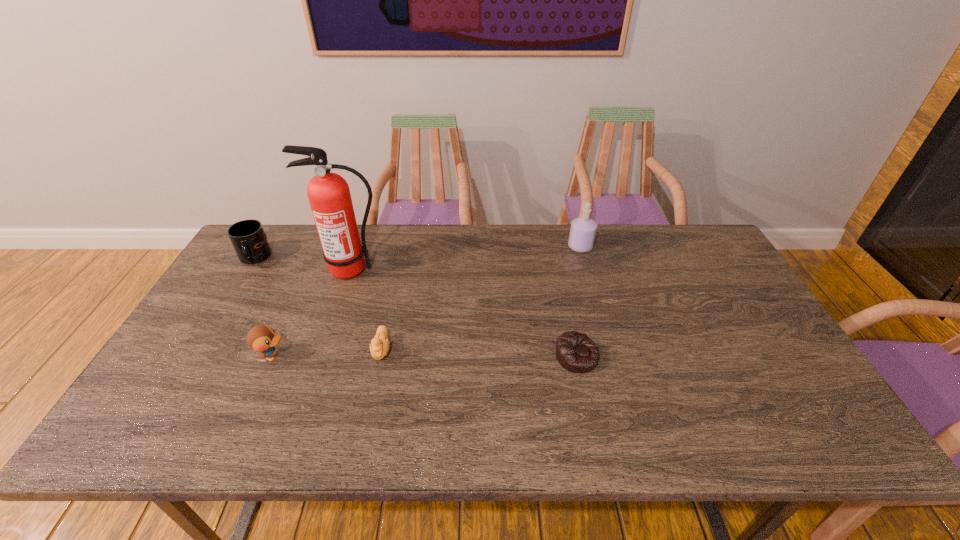
You are a GUI agent. You are given a task and a screenshot of the screen. Output one action in this format:
    pyautogui.click(x=<x>, y=<y>)
    Task: Click on the vacant space at the right edge of the desktop
    The width and height of the screenshot is (960, 540).
    Given the screenshot: What is the action you would take?
    pyautogui.click(x=765, y=363)

The width and height of the screenshot is (960, 540). I want to click on free location at the far left corner of the desktop, so click(x=232, y=268).

I want to click on free space at the far right corner of the desktop, so click(701, 263).

I want to click on vacant area that lies between the tallest object and the second tallest object, so click(467, 258).

Where is `free space between the second shortest object and the fire extinguisher`? The height and width of the screenshot is (540, 960). free space between the second shortest object and the fire extinguisher is located at coordinates (367, 309).

Find the location of a particular element. This screenshot has width=960, height=540. vacant region between the fifth tallest object and the duck is located at coordinates (327, 353).

Where is `empty space between the duck and the shortest object`? empty space between the duck and the shortest object is located at coordinates (425, 356).

Where is `vacant area that lies between the duck and the mug`? The width and height of the screenshot is (960, 540). vacant area that lies between the duck and the mug is located at coordinates (264, 308).

The image size is (960, 540). I want to click on empty location between the beanbag and the mug, so click(x=416, y=307).

I want to click on vacant space that is in between the leftmost object and the duck, so click(x=264, y=308).